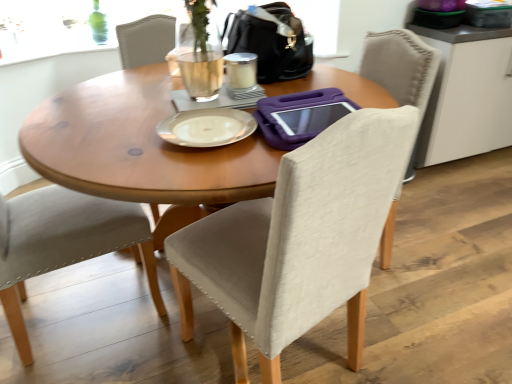
What do you see at coordinates (271, 42) in the screenshot? I see `black leather handbag at upper center` at bounding box center [271, 42].

What do you see at coordinates (241, 70) in the screenshot?
I see `matte glass coffee cup at center` at bounding box center [241, 70].

The image size is (512, 384). What do you see at coordinates (467, 94) in the screenshot?
I see `white matte cabinet at upper right` at bounding box center [467, 94].

In order to face white matte cabinet at upper right, should I rotate leftwards or rightwards?

You should rotate right by 27.937 degrees.

You are a GUI agent. You are given a task and a screenshot of the screen. Output one action in this format:
    pyautogui.click(x=<x>, y=<y>)
    Task: Click on the silver metallic plate at center
    The height and width of the screenshot is (384, 512).
    Given the screenshot: What is the action you would take?
    pyautogui.click(x=207, y=127)

The image size is (512, 384). I want to click on black leather handbag at upper center, so click(271, 42).

Is matte glass coffee cup at center situated inside black leather handbag at upper center or outside?

matte glass coffee cup at center exists outside the volume of black leather handbag at upper center.

Considering the positions of point (234, 64) and point (262, 52), is point (234, 64) closer or farther from the camera than point (262, 52)?

Point (234, 64) is closer to the camera than point (262, 52).

Visually, is matte glass coffee cup at center positioned to the left or to the right of black leather handbag at upper center?

Based on their positions, matte glass coffee cup at center is located to the left of black leather handbag at upper center.

From a real-world perspective, between silver metallic plate at center and black leather handbag at upper center, who is vertically lower?

silver metallic plate at center, from a real-world perspective.

Find the location of `handbag above the silver metallic plate at center (from a real-world perspective)`. handbag above the silver metallic plate at center (from a real-world perspective) is located at coordinates (271, 42).

Is silver metallic plate at center positioned behind black leather handbag at upper center?

No, the depth of silver metallic plate at center is less than that of black leather handbag at upper center.

Considering the sizes of objects silver metallic plate at center and black leather handbag at upper center in the image provided, who is shorter, silver metallic plate at center or black leather handbag at upper center?

Standing shorter between the two is silver metallic plate at center.

The height and width of the screenshot is (384, 512). Find the location of `cabinetry located on the right of black leather handbag at upper center`. cabinetry located on the right of black leather handbag at upper center is located at coordinates (467, 94).

From a real-world perspective, between white matte cabinet at upper right and black leather handbag at upper center, who is vertically higher?

black leather handbag at upper center.

Would you say white matte cabinet at upper right is outside black leather handbag at upper center?

Indeed, white matte cabinet at upper right is completely outside black leather handbag at upper center.

From the picture: Is white matte cabinet at upper right shorter than black leather handbag at upper center?

No, white matte cabinet at upper right is not shorter than black leather handbag at upper center.

From a real-world perspective, is white matte cabinet at upper right on top of light beige fabric chair at left, which appears as the 2th chair when viewed from the right?

No.

What's the angular difference between white matte cabinet at upper right and light beige fabric chair at left, which is the first chair in left-to-right order,'s facing directions?

The angle between the facing direction of white matte cabinet at upper right and the facing direction of light beige fabric chair at left, which is the first chair in left-to-right order, is 91 degrees.

From the image's perspective, which one is positioned lower, white matte cabinet at upper right or light beige fabric chair at left, which is the first chair in left-to-right order?

light beige fabric chair at left, which is the first chair in left-to-right order, appears lower in the image.

Considering the sizes of objects white matte cabinet at upper right and light beige fabric chair at left, which appears as the 2th chair when viewed from the right, in the image provided, who is wider, white matte cabinet at upper right or light beige fabric chair at left, which appears as the 2th chair when viewed from the right,?

light beige fabric chair at left, which appears as the 2th chair when viewed from the right.

Is beige fabric chair at center, the 1th chair when ordered from right to left, in front of wooden table at center?

Yes, beige fabric chair at center, the 1th chair when ordered from right to left, is closer to the viewer.

How different are the orientations of beige fabric chair at center, the 1th chair when ordered from right to left, and wooden table at center in degrees?

72 degrees.

Image resolution: width=512 pixels, height=384 pixels. In order to click on the 1st chair above the wooden table at center (from the image's perspective) in this screenshot , I will do `click(298, 240)`.

Between beige fabric chair at center, which is counted as the 2th chair, starting from the left, and wooden table at center, which one has smaller size?

beige fabric chair at center, which is counted as the 2th chair, starting from the left.

In terms of width, does beige fabric chair at center, the 1th chair when ordered from right to left, look wider or thinner when compared to light beige fabric chair at left, which appears as the 2th chair when viewed from the right?

In the image, beige fabric chair at center, the 1th chair when ordered from right to left, appears to be more narrow than light beige fabric chair at left, which appears as the 2th chair when viewed from the right.

Can you see beige fabric chair at center, the 1th chair when ordered from right to left, touching light beige fabric chair at left, which is the first chair in left-to-right order?

No.

Can we say beige fabric chair at center, which is counted as the 2th chair, starting from the left, lies outside light beige fabric chair at left, which is the first chair in left-to-right order?

Absolutely, beige fabric chair at center, which is counted as the 2th chair, starting from the left, is external to light beige fabric chair at left, which is the first chair in left-to-right order.

How different are the orientations of beige fabric chair at center, the 1th chair when ordered from right to left, and light beige fabric chair at left, which appears as the 2th chair when viewed from the right, in degrees?

The angle between the facing direction of beige fabric chair at center, the 1th chair when ordered from right to left, and the facing direction of light beige fabric chair at left, which appears as the 2th chair when viewed from the right, is 107 degrees.

From the image's perspective, is beige fabric chair at center, which is counted as the 2th chair, starting from the left, located above or below black leather handbag at upper center?

beige fabric chair at center, which is counted as the 2th chair, starting from the left, is situated lower than black leather handbag at upper center in the image.

Which of these two, beige fabric chair at center, which is counted as the 2th chair, starting from the left, or black leather handbag at upper center, is smaller?

black leather handbag at upper center is smaller.

Is beige fabric chair at center, which is counted as the 2th chair, starting from the left, not inside black leather handbag at upper center?

Yes, beige fabric chair at center, which is counted as the 2th chair, starting from the left, is outside of black leather handbag at upper center.

From a real-world perspective, is beige fabric chair at center, which is counted as the 2th chair, starting from the left, located higher than black leather handbag at upper center?

No, from a real-world perspective, beige fabric chair at center, which is counted as the 2th chair, starting from the left, is not on top of black leather handbag at upper center.

Locate an element on the screen. The height and width of the screenshot is (384, 512). handbag on the right of matte glass coffee cup at center is located at coordinates (271, 42).

I want to click on handbag above the silver metallic plate at center (from a real-world perspective), so click(x=271, y=42).

Which object lies nearer to the anchor point white matte cabinet at upper right, black leather handbag at upper center or matte glass coffee cup at center?

black leather handbag at upper center is positioned closer to the anchor white matte cabinet at upper right.

Based on their spatial positions, is silver metallic plate at center or wooden table at center closer to light beige fabric chair at left, which is the first chair in left-to-right order?

wooden table at center lies closer to light beige fabric chair at left, which is the first chair in left-to-right order, than the other object.

Based on their spatial positions, is beige fabric chair at center, which is counted as the 2th chair, starting from the left, or wooden table at center closer to black leather handbag at upper center?

Among the two, wooden table at center is located nearer to black leather handbag at upper center.

Estimate the real-world distances between objects in this image. Which object is further from beige fabric chair at center, the 1th chair when ordered from right to left, black leather handbag at upper center or white matte cabinet at upper right?

The object further to beige fabric chair at center, the 1th chair when ordered from right to left, is white matte cabinet at upper right.

When comparing their distances from light beige fabric chair at left, which appears as the 2th chair when viewed from the right, does beige fabric chair at center, which is counted as the 2th chair, starting from the left, or silver metallic plate at center seem closer?

silver metallic plate at center lies closer to light beige fabric chair at left, which appears as the 2th chair when viewed from the right, than the other object.

Estimate the real-world distances between objects in this image. Which object is further from beige fabric chair at center, which is counted as the 2th chair, starting from the left, silver metallic plate at center or light beige fabric chair at left, which is the first chair in left-to-right order?

Among the two, light beige fabric chair at left, which is the first chair in left-to-right order, is located further to beige fabric chair at center, which is counted as the 2th chair, starting from the left.

Looking at the image, which one is located further to matte glass coffee cup at center, black leather handbag at upper center or wooden table at center?

wooden table at center is further to matte glass coffee cup at center.

Based on their spatial positions, is silver metallic plate at center or beige fabric chair at center, which is counted as the 2th chair, starting from the left, further from wooden table at center?

beige fabric chair at center, which is counted as the 2th chair, starting from the left, is positioned further to the anchor wooden table at center.

Locate an element on the screen. kitchen & dining room table between silver metallic plate at center and white matte cabinet at upper right in the horizontal direction is located at coordinates (138, 146).

Locate an element on the screen. Image resolution: width=512 pixels, height=384 pixels. coffee cup between light beige fabric chair at left, which appears as the 2th chair when viewed from the right, and black leather handbag at upper center, in the horizontal direction is located at coordinates (241, 70).

In order to click on coffee cup between silver metallic plate at center and wooden table at center in this screenshot , I will do `click(241, 70)`.

You are a GUI agent. You are given a task and a screenshot of the screen. Output one action in this format:
    pyautogui.click(x=<x>, y=<y>)
    Task: Click on the plate between beige fabric chair at center, the 1th chair when ordered from right to left, and matte glass coffee cup at center from front to back
    This screenshot has height=384, width=512.
    Given the screenshot: What is the action you would take?
    pyautogui.click(x=207, y=127)